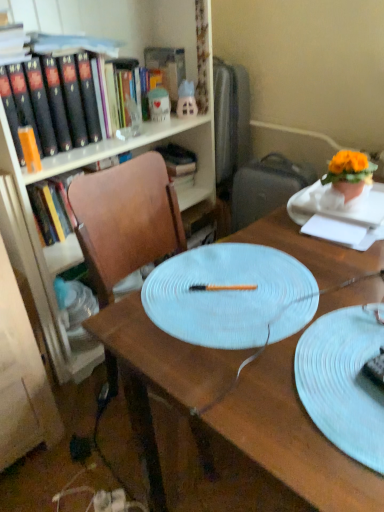
Where is `free space in front of white paper at upper right`? free space in front of white paper at upper right is located at coordinates (341, 270).